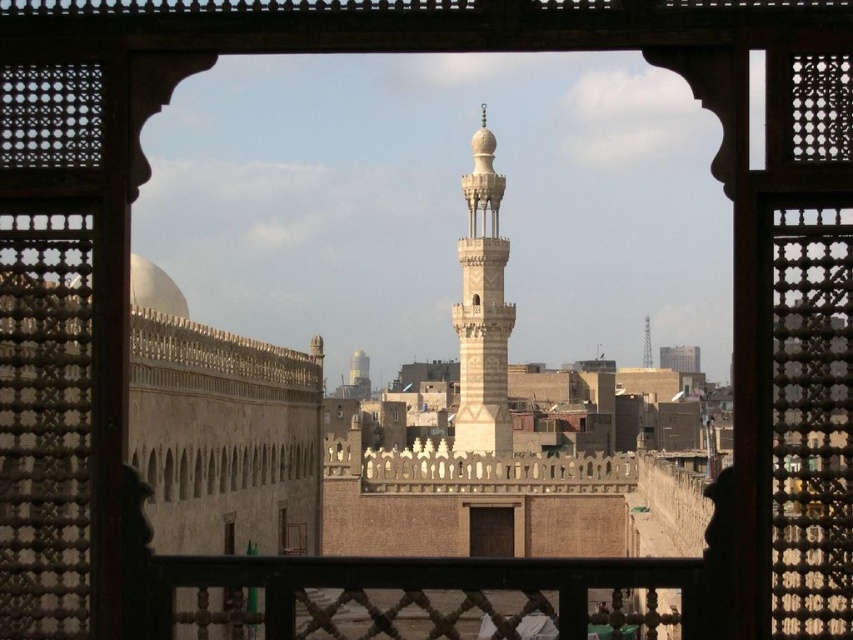
Between point (509, 426) and point (645, 330), which one is positioned in front?

Point (509, 426) is more forward.

Between white stone minaret at center and smooth concrete tower at center, which one is positioned higher?

white stone minaret at center is above.

What do you see at coordinates (482, 308) in the screenshot? I see `white stone minaret at center` at bounding box center [482, 308].

Where is `white stone minaret at center`? white stone minaret at center is located at coordinates (482, 308).